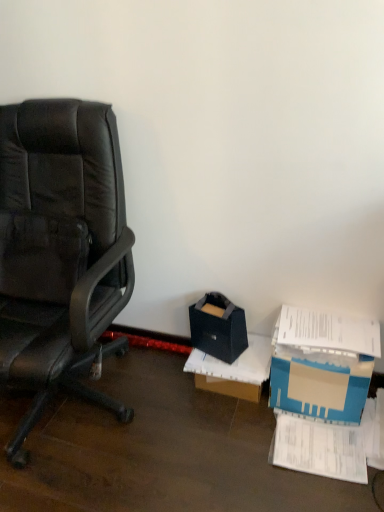
Image resolution: width=384 pixels, height=512 pixels. What do you see at coordinates (318, 448) in the screenshot?
I see `white paper at lower right` at bounding box center [318, 448].

This screenshot has height=512, width=384. Find the location of `cardboard box at center`. cardboard box at center is located at coordinates (233, 370).

Does blue cardboard box at lower right appear on the left side of white paper at lower right?

No, blue cardboard box at lower right is not to the left of white paper at lower right.

Is the position of blue cardboard box at lower right less distant than that of white paper at lower right?

No.

At what (x,y) coordinates should I click in order to perform the action: click on paperback book on the left of blue cardboard box at lower right. Please return your answer as a coordinate pair (x, y). The height and width of the screenshot is (512, 384). Looking at the image, I should click on (318, 448).

Is white paper at lower right inside blue cardboard box at lower right?

Definitely not — white paper at lower right is not inside blue cardboard box at lower right.

Is matte black storage box at center wider or thinner than white paper at lower right?

Considering their sizes, matte black storage box at center looks slimmer than white paper at lower right.

Considering the relative sizes of matte black storage box at center and white paper at lower right in the image provided, is matte black storage box at center shorter than white paper at lower right?

Incorrect, the height of matte black storage box at center does not fall short of that of white paper at lower right.

Is matte black storage box at center outside of white paper at lower right?

Yes, matte black storage box at center is not within white paper at lower right.

From a real-world perspective, who is located higher, matte black storage box at center or white paper at lower right?

matte black storage box at center.

In the scene shown: Between blue cardboard box at lower right and black leather office chair at left, which one has less height?

Standing shorter between the two is blue cardboard box at lower right.

Considering the sizes of objects blue cardboard box at lower right and black leather office chair at left in the image provided, who is thinner, blue cardboard box at lower right or black leather office chair at left?

Thinner between the two is blue cardboard box at lower right.

Between point (305, 320) and point (12, 201), which one is positioned in front?

Point (305, 320)

From the image's perspective, is blue cardboard box at lower right above black leather office chair at left?

No, from the image's perspective, blue cardboard box at lower right is not above black leather office chair at left.

From a real-world perspective, is white paper at lower right positioned above or below matte black storage box at center?

From a real-world perspective, white paper at lower right is physically below matte black storage box at center.

Is white paper at lower right not inside matte black storage box at center?

Indeed, white paper at lower right is completely outside matte black storage box at center.

Is white paper at lower right turned away from matte black storage box at center?

No, white paper at lower right's orientation is not away from matte black storage box at center.

From the image's perspective, is matte black storage box at center located above cardboard box at center?

Yes.

Between point (209, 332) and point (200, 375), which one is positioned behind?

The point (200, 375) is farther from the camera.

Is cardboard box at center at the back of matte black storage box at center?

No, matte black storage box at center's orientation is not away from cardboard box at center.

From a real-world perspective, is matte black storage box at center above or below cardboard box at center?

In terms of real-world spatial position, matte black storage box at center is above cardboard box at center.

Between blue cardboard box at lower right and matte black storage box at center, which one has smaller size?

With smaller size is matte black storage box at center.

Does point (275, 387) lie behind point (195, 304)?

No, (275, 387) is in front of (195, 304).

Which of these two, blue cardboard box at lower right or matte black storage box at center, is thinner?

With smaller width is matte black storage box at center.

Is blue cardboard box at lower right looking in the opposite direction of matte black storage box at center?

No, blue cardboard box at lower right is not facing away from matte black storage box at center.

Between black leather office chair at left and matte black storage box at center, which one has less height?

Standing shorter between the two is matte black storage box at center.

Who is more distant, black leather office chair at left or matte black storage box at center?

matte black storage box at center.

Consider the image. Is black leather office chair at left at the right side of matte black storage box at center?

No.

Is black leather office chair at left in contact with matte black storage box at center?

No, black leather office chair at left is not with matte black storage box at center.

You are a GUI agent. You are given a task and a screenshot of the screen. Output one action in this format:
    pyautogui.click(x=<x>, y=<y>)
    Task: Click on the paperback book below the blue cardboard box at lower right (from a real-world perspective)
    This screenshot has height=512, width=384.
    Given the screenshot: What is the action you would take?
    pyautogui.click(x=318, y=448)

You are a GUI agent. You are given a task and a screenshot of the screen. Output one action in this format:
    pyautogui.click(x=<x>, y=<y>)
    Task: Click on the storage box on the left of white paper at lower right
    This screenshot has width=384, height=512.
    Given the screenshot: What is the action you would take?
    pyautogui.click(x=218, y=328)

When comparing their distances from white paper at lower right, does cardboard box at center or blue cardboard box at lower right seem closer?

blue cardboard box at lower right.

From the image, which object appears to be farther from cardboard box at center, matte black storage box at center or black leather office chair at left?

black leather office chair at left is positioned further to the anchor cardboard box at center.

Based on the photo, from the image, which object appears to be farther from matte black storage box at center, cardboard box at center or white paper at lower right?

white paper at lower right is further to matte black storage box at center.

When comparing their distances from cardboard box at center, does white paper at lower right or black leather office chair at left seem closer?

Among the two, white paper at lower right is located nearer to cardboard box at center.

Estimate the real-world distances between objects in this image. Which object is closer to matte black storage box at center, cardboard box at center or blue cardboard box at lower right?

Among the two, cardboard box at center is located nearer to matte black storage box at center.

Looking at the image, which one is located closer to black leather office chair at left, white paper at lower right or cardboard box at center?

cardboard box at center.

From the image, which object appears to be farther from blue cardboard box at lower right, cardboard box at center or matte black storage box at center?

matte black storage box at center.

Which object lies nearer to the anchor point blue cardboard box at lower right, cardboard box at center or white paper at lower right?

Based on the image, white paper at lower right appears to be nearer to blue cardboard box at lower right.

The height and width of the screenshot is (512, 384). What are the coordinates of `paperback book between cardboard box at center and blue cardboard box at lower right in the horizontal direction` in the screenshot? It's located at (318, 448).

Locate an element on the screen. paperback book between matte black storage box at center and blue cardboard box at lower right is located at coordinates (318, 448).

Identify the location of storage box between black leather office chair at left and blue cardboard box at lower right. (218, 328).

Find the location of `storage box situated between black leather office chair at left and white paper at lower right from left to right`. storage box situated between black leather office chair at left and white paper at lower right from left to right is located at coordinates (218, 328).